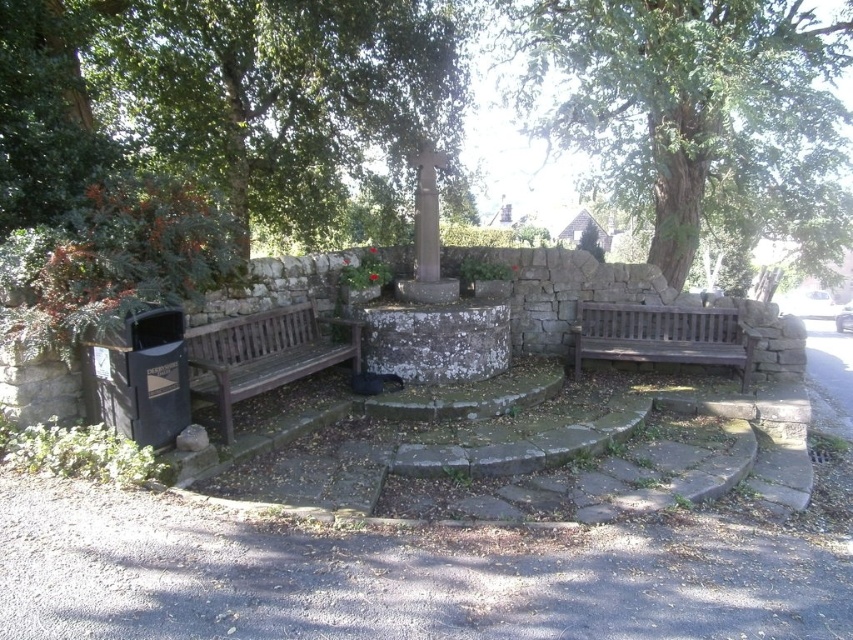
Who is more forward, (x=601, y=340) or (x=426, y=282)?

Point (x=426, y=282)

At what (x,y) coordinates should I click in order to perform the action: click on brown wooden bench at right. Please return your answer as a coordinate pair (x, y). The width and height of the screenshot is (853, 640). Looking at the image, I should click on (663, 336).

Who is shorter, wooden bench at left or brown wooden bench at right?

brown wooden bench at right

Which is in front, point (282, 362) or point (706, 360)?

Point (282, 362) is more forward.

Image resolution: width=853 pixels, height=640 pixels. In order to click on wooden bench at left in this screenshot , I will do `click(264, 353)`.

Can you confirm if wooden bench at left is taller than smooth stone pillar at center?

No.

The image size is (853, 640). What do you see at coordinates (264, 353) in the screenshot? I see `wooden bench at left` at bounding box center [264, 353].

I want to click on wooden bench at left, so [x=264, y=353].

Where is `wooden bench at left`? This screenshot has width=853, height=640. wooden bench at left is located at coordinates (264, 353).